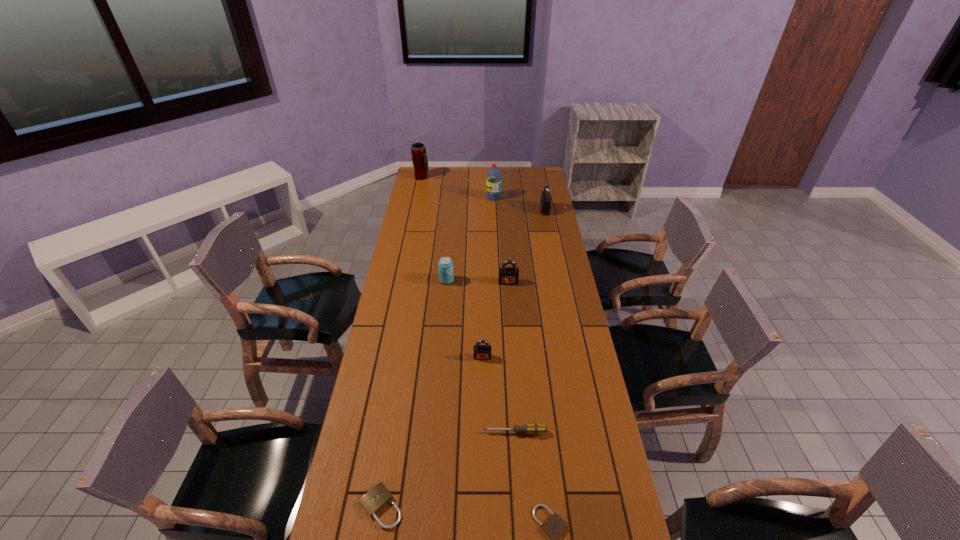
Image resolution: width=960 pixels, height=540 pixels. I want to click on the second farthest object, so 493,176.

This screenshot has height=540, width=960. Find the location of `water bottle`. water bottle is located at coordinates (493, 176).

Where is `the farthest object`? This screenshot has height=540, width=960. the farthest object is located at coordinates (419, 158).

You are a GUI agent. You are given a task and a screenshot of the screen. Output one action in this format:
    pyautogui.click(x=<x>, y=<y>)
    Task: Click on the thermos bottle
    
    Given the screenshot: What is the action you would take?
    pyautogui.click(x=419, y=158)

The width and height of the screenshot is (960, 540). In order to click on the biggest gray padlock in this screenshot , I will do `click(545, 201)`.

This screenshot has height=540, width=960. I want to click on the rightmost object, so click(545, 201).

The height and width of the screenshot is (540, 960). What are the coordinates of `the second farthest padlock` in the screenshot? It's located at (507, 275).

The width and height of the screenshot is (960, 540). I want to click on the second tallest padlock, so click(x=507, y=275).

The image size is (960, 540). I want to click on the seventh object from right to left, so click(x=445, y=265).

Locate an element on the screen. This screenshot has height=540, width=960. the fourth padlock from right to left is located at coordinates (481, 352).